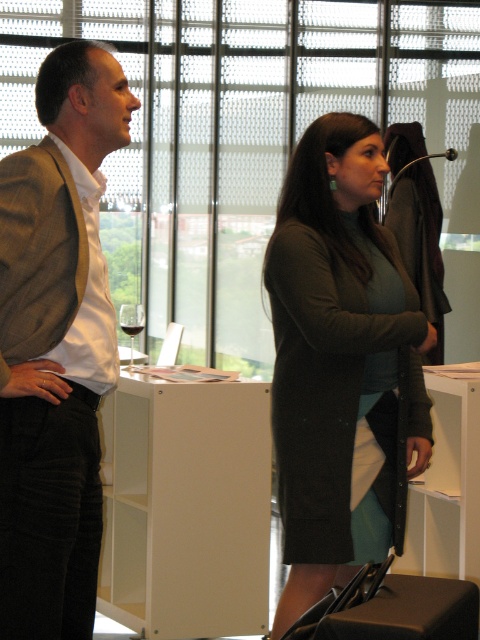
Which is more to the right, dark green sweater at center or transparent glass wine glass at center?

From the viewer's perspective, dark green sweater at center appears more on the right side.

Is dark green sweater at center positioned behind transparent glass wine glass at center?

No, it is not.

Find the location of a particular element. dark green sweater at center is located at coordinates (340, 364).

Identify the location of dark green sweater at center. The height and width of the screenshot is (640, 480). (340, 364).

Is matte brown blazer at left to the left of transparent glass wine glass at center from the viewer's perspective?

No, matte brown blazer at left is not to the left of transparent glass wine glass at center.

Based on the photo, who is more distant from viewer, (86, 550) or (132, 340)?

Point (132, 340)

This screenshot has width=480, height=640. Identify the location of matte brown blazer at left. (56, 348).

Is dark green sweater at center thinner than translucent glass wine at center?

No.

Which is in front, point (317, 428) or point (122, 328)?

Point (317, 428)

At what (x,y) coordinates should I click in order to perform the action: click on dark green sweater at center. Please return your answer as a coordinate pair (x, y). This screenshot has width=480, height=640. Looking at the image, I should click on (340, 364).